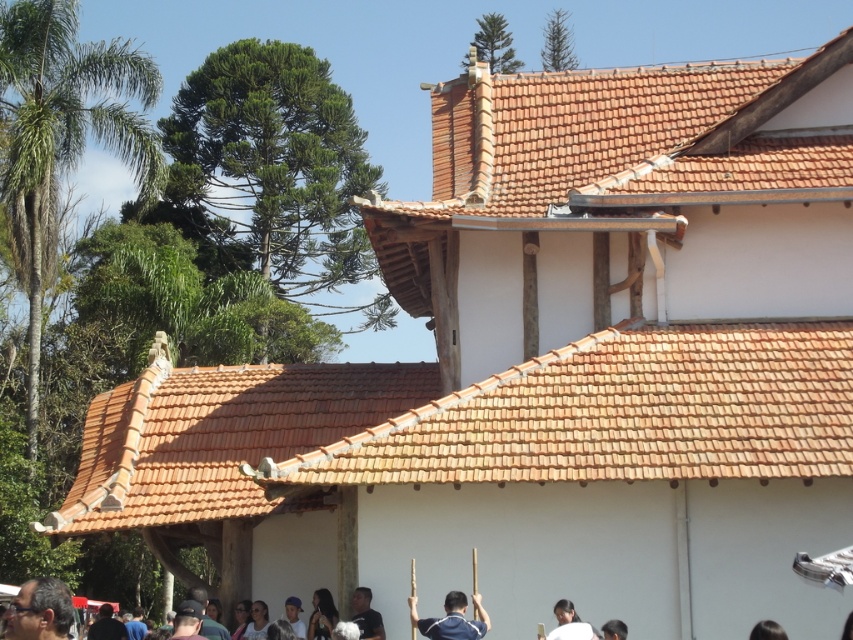
Question: Does green leafy palm tree at upper left have a smaller size compared to dark brown hair at lower left?

Choices:
 (A) no
 (B) yes

Answer: (A)

Question: Which object is the farthest from the dark brown hair at lower left?

Choices:
 (A) green leafy palm tree at upper left
 (B) dark blue shirt at center
 (C) dark brown hair at lower right
 (D) orange clay tiles at center

Answer: (A)

Question: Estimate the real-world distances between objects in this image. Which object is farther from the white matte shirt at lower center?

Choices:
 (A) blue fabric shirt at center
 (B) dark brown hair at lower right

Answer: (A)

Question: Can you confirm if blue fabric shirt at center is smaller than dark brown hair at lower right?

Choices:
 (A) yes
 (B) no

Answer: (B)

Question: Is orange clay tiles at center below dark brown hair at lower right?

Choices:
 (A) yes
 (B) no

Answer: (B)

Question: Considering the real-world distances, which object is farthest from the dark brown hair at lower right?

Choices:
 (A) dark blue shirt at center
 (B) blue fabric shirt at center
 (C) white matte shirt at lower center

Answer: (A)